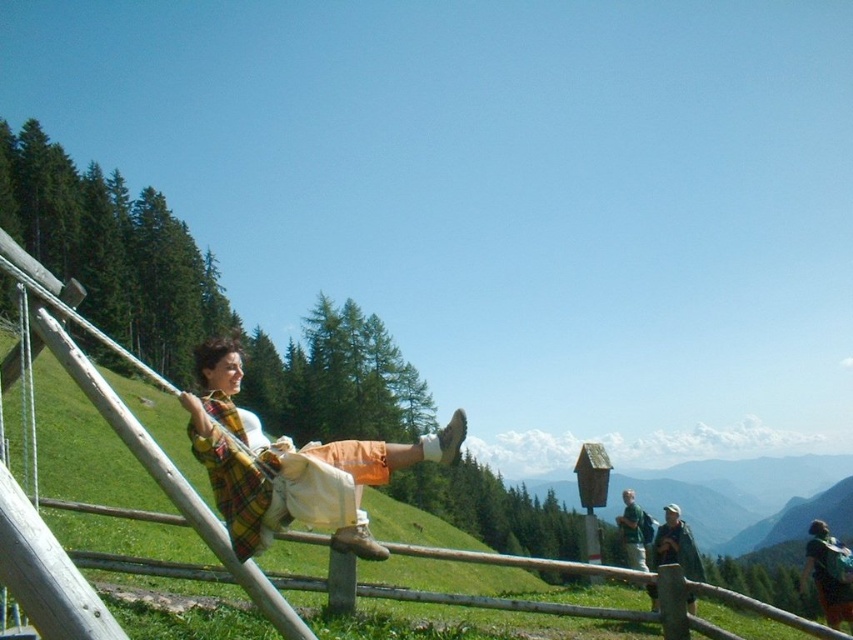
You are organizing a hiking trip and need to pack your gear. You have a green fabric backpack at lower right and a green fabric shirt at upper right. Which item should you choose if you need more storage space?

The green fabric backpack at lower right is larger in size than the green fabric shirt at upper right, so you should choose the green fabric backpack at lower right for more storage space.

You are standing at the origin point of the image and want to move towards the point at the bottom right corner. Which point, point [828,616] or point [664,534], would you encounter first?

Point [664,534] would be encountered first because it is in front of point [828,616].